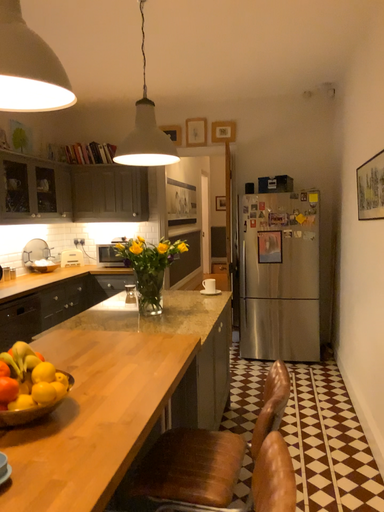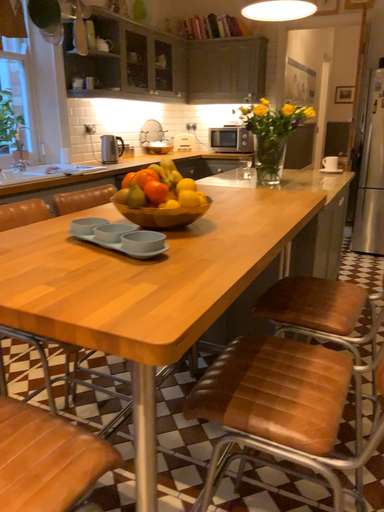
Question: Which way did the camera rotate in the video?

Choices:
 (A) rotated downward
 (B) rotated upward

Answer: (A)